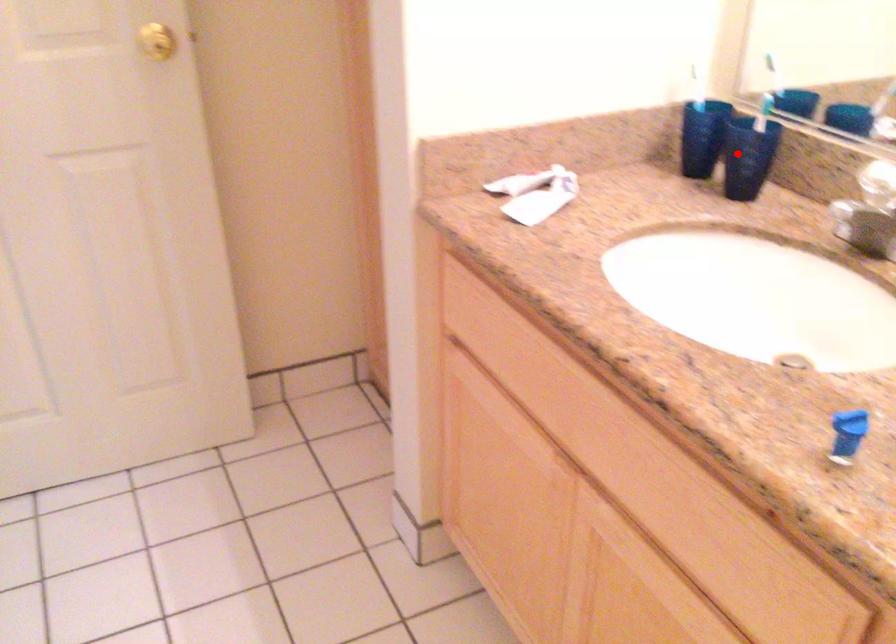
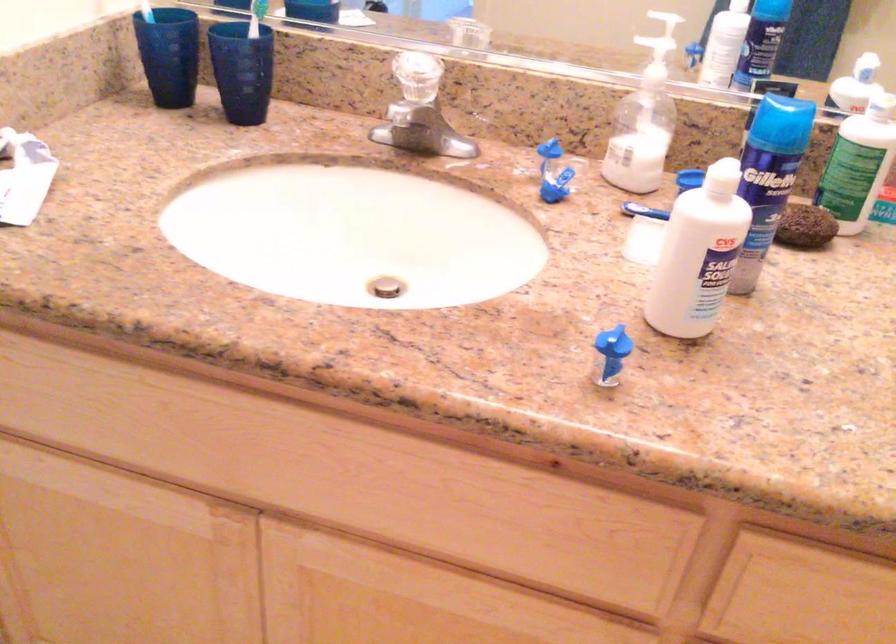
Question: I am providing you with two images of the same scene from different viewpoints. Given a red point in image1, look at the same physical point in image2. Is it:

Choices:
 (A) Closer to the viewpoint
 (B) Farther from the viewpoint

Answer: (A)